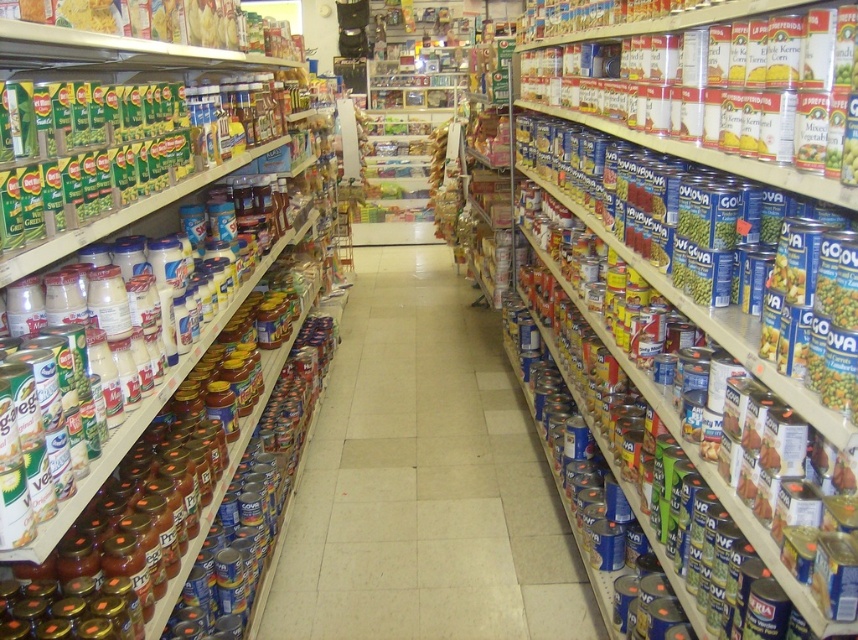
Can you confirm if metallic cans at left is thinner than metallic cans at center?

Indeed, metallic cans at left has a lesser width compared to metallic cans at center.

What do you see at coordinates (146, 337) in the screenshot? The image size is (858, 640). I see `metallic cans at left` at bounding box center [146, 337].

At what (x,y) coordinates should I click in order to perform the action: click on metallic cans at left. Please return your answer as a coordinate pair (x, y). The height and width of the screenshot is (640, 858). Looking at the image, I should click on (146, 337).